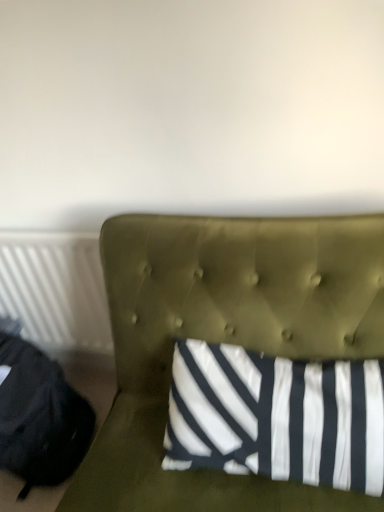
This screenshot has width=384, height=512. Describe the element at coordinates (40, 417) in the screenshot. I see `black fabric bean bag chair at left` at that location.

The image size is (384, 512). Find the location of `white plastic radiator at left`. white plastic radiator at left is located at coordinates pos(55,290).

Is olive green tufted headboard at center far from white plastic radiator at left?

Actually, olive green tufted headboard at center and white plastic radiator at left are a little close together.

Is point (282, 325) positioned in front of point (73, 271)?

Yes, it is in front of point (73, 271).

Does olive green tufted headboard at center appear on the right side of white plastic radiator at left?

Yes, olive green tufted headboard at center is to the right of white plastic radiator at left.

From a real-world perspective, is olive green tufted headboard at center positioned under white plastic radiator at left based on gravity?

No, from a real-world perspective, olive green tufted headboard at center is not under white plastic radiator at left.

Considering the sizes of objects black fabric bean bag chair at left and white plastic radiator at left in the image provided, who is smaller, black fabric bean bag chair at left or white plastic radiator at left?

white plastic radiator at left is smaller.

Considering the sizes of objects black fabric bean bag chair at left and white plastic radiator at left in the image provided, who is wider, black fabric bean bag chair at left or white plastic radiator at left?

With larger width is black fabric bean bag chair at left.

From a real-world perspective, is black fabric bean bag chair at left physically above white plastic radiator at left?

No, from a real-world perspective, black fabric bean bag chair at left is not over white plastic radiator at left

Which is more to the left, black fabric bean bag chair at left or white plastic radiator at left?

black fabric bean bag chair at left.

Looking at this image, considering the sizes of white plastic radiator at left and black fabric bean bag chair at left in the image, is white plastic radiator at left taller or shorter than black fabric bean bag chair at left?

Considering their sizes, white plastic radiator at left has more height than black fabric bean bag chair at left.

Would you say white plastic radiator at left contains black fabric bean bag chair at left?

No, white plastic radiator at left does not contain black fabric bean bag chair at left.

Based on their sizes in the image, would you say white plastic radiator at left is bigger or smaller than black fabric bean bag chair at left?

Clearly, white plastic radiator at left is smaller in size than black fabric bean bag chair at left.

Looking at this image, is olive green tufted headboard at center situated inside black fabric bean bag chair at left or outside?

olive green tufted headboard at center is not inside black fabric bean bag chair at left, it's outside.

Does olive green tufted headboard at center turn towards black fabric bean bag chair at left?

No, olive green tufted headboard at center is not oriented towards black fabric bean bag chair at left.

What's the angular difference between olive green tufted headboard at center and black fabric bean bag chair at left's facing directions?

They differ by 70 degrees in their facing directions.

Considering the relative sizes of olive green tufted headboard at center and black fabric bean bag chair at left in the image provided, is olive green tufted headboard at center taller than black fabric bean bag chair at left?

Indeed, olive green tufted headboard at center has a greater height compared to black fabric bean bag chair at left.

Is black fabric bean bag chair at left aimed at olive green tufted headboard at center?

Yes, black fabric bean bag chair at left is turned towards olive green tufted headboard at center.

Which object is further away from the camera, black fabric bean bag chair at left or olive green tufted headboard at center?

black fabric bean bag chair at left is further away from the camera.

Measure the distance from black fabric bean bag chair at left to olive green tufted headboard at center.

20.07 inches.

From a real-world perspective, who is located higher, black fabric bean bag chair at left or olive green tufted headboard at center?

olive green tufted headboard at center, from a real-world perspective.

Considering the sizes of objects white plastic radiator at left and olive green tufted headboard at center in the image provided, who is taller, white plastic radiator at left or olive green tufted headboard at center?

olive green tufted headboard at center is taller.

From a real-world perspective, is white plastic radiator at left on olive green tufted headboard at center?

No, from a real-world perspective, white plastic radiator at left is not over olive green tufted headboard at center

Considering the positions of objects white plastic radiator at left and olive green tufted headboard at center in the image provided, who is behind, white plastic radiator at left or olive green tufted headboard at center?

Positioned behind is white plastic radiator at left.

Does point (2, 239) come in front of point (288, 270)?

No, it is not.

The height and width of the screenshot is (512, 384). I want to click on furniture above the white plastic radiator at left (from a real-world perspective), so click(x=221, y=317).

Locate an element on the screen. This screenshot has width=384, height=512. radiator lying behind the black fabric bean bag chair at left is located at coordinates (55, 290).

Estimate the real-world distances between objects in this image. Which object is further from white plastic radiator at left, olive green tufted headboard at center or black fabric bean bag chair at left?

Among the two, olive green tufted headboard at center is located further to white plastic radiator at left.

Considering their positions, is white plastic radiator at left positioned closer to black fabric bean bag chair at left than olive green tufted headboard at center?

The object closer to black fabric bean bag chair at left is white plastic radiator at left.

Looking at the image, which one is located further to white plastic radiator at left, black fabric bean bag chair at left or olive green tufted headboard at center?

olive green tufted headboard at center.

Looking at the image, which one is located closer to black fabric bean bag chair at left, olive green tufted headboard at center or white plastic radiator at left?

white plastic radiator at left.

In the scene shown: Which object lies further to the anchor point olive green tufted headboard at center, black fabric bean bag chair at left or white plastic radiator at left?

white plastic radiator at left lies further to olive green tufted headboard at center than the other object.

Looking at this image, from the image, which object appears to be nearer to olive green tufted headboard at center, white plastic radiator at left or black fabric bean bag chair at left?

Among the two, black fabric bean bag chair at left is located nearer to olive green tufted headboard at center.

This screenshot has height=512, width=384. Find the location of `bean bag chair between olive green tufted headboard at center and white plastic radiator at left in the front-back direction`. bean bag chair between olive green tufted headboard at center and white plastic radiator at left in the front-back direction is located at coordinates (40, 417).